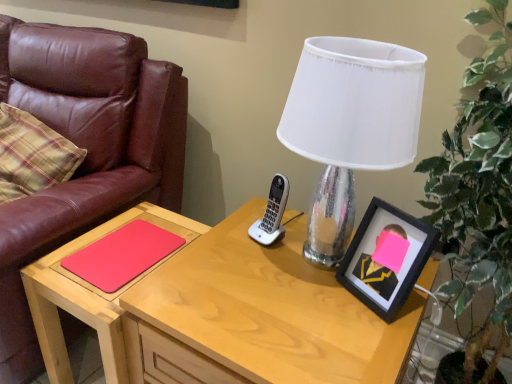
I want to click on vacant area on top of matte wood desk at center (from a real-world perspective), so click(282, 300).